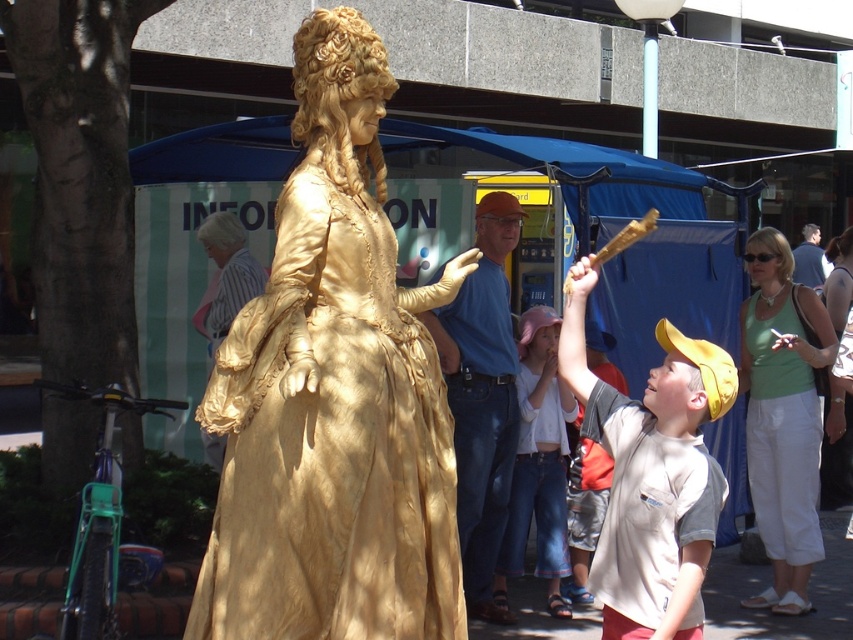
Who is more distant from viewer, (808, 417) or (555, 465)?

Point (555, 465)

Is green fabric shirt at upper right below white cotton shirt at center?

No, green fabric shirt at upper right is not below white cotton shirt at center.

Measure the distance between green fabric shirt at upper right and camera.

green fabric shirt at upper right is 7.35 meters away from camera.

Where is `green fabric shirt at upper right`? This screenshot has width=853, height=640. green fabric shirt at upper right is located at coordinates (782, 417).

Does gold silk statue at center appear on the left side of white cotton shirt at center?

Correct, you'll find gold silk statue at center to the left of white cotton shirt at center.

Between gold silk statue at center and white cotton shirt at center, which one is positioned higher?

gold silk statue at center is higher up.

Who is more distant from viewer, (x=367, y=472) or (x=544, y=481)?

Point (x=544, y=481)

This screenshot has width=853, height=640. I want to click on gold silk statue at center, so click(334, 396).

Between blue denim jeans at center and matte green tank top at upper right, which one appears on the right side from the viewer's perspective?

matte green tank top at upper right

Does blue denim jeans at center have a lesser width compared to matte green tank top at upper right?

No, blue denim jeans at center is not thinner than matte green tank top at upper right.

Does point (492, 472) lie in front of point (838, 308)?

Yes.

This screenshot has height=640, width=853. Find the location of `blue denim jeans at center`. blue denim jeans at center is located at coordinates (482, 396).